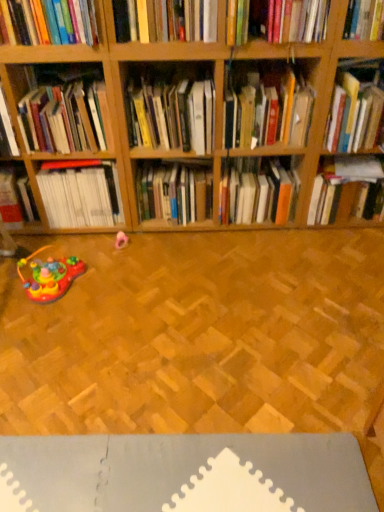
At what (x,y) coordinates should I click in order to perform the action: click on empty space that is in between pink rubber duck at center, which is counted as the 2th toy, starting from the bottom, and gray foam mat at lower center. Please return your answer as a coordinate pair (x, y). This screenshot has width=384, height=512. Looking at the image, I should click on (162, 353).